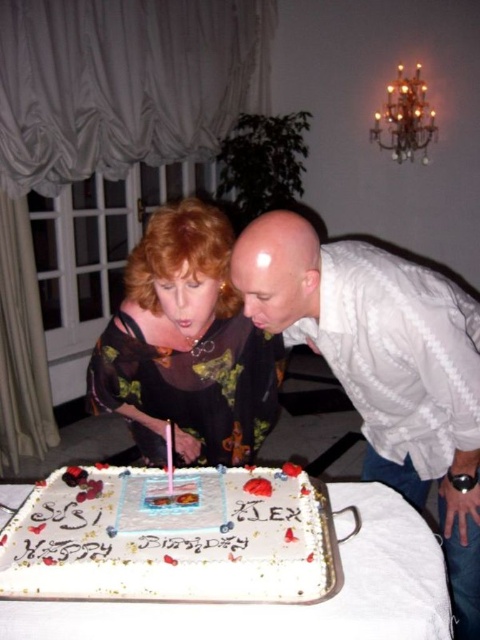
Question: Considering the relative positions of white cardboard cake at center and pink wax candle at center in the image provided, where is white cardboard cake at center located with respect to pink wax candle at center?

Choices:
 (A) left
 (B) right

Answer: (B)

Question: Can you confirm if white textured shirt at center is positioned above pink wax candle at center?

Choices:
 (A) no
 (B) yes

Answer: (B)

Question: Is white textured shirt at center positioned behind pink wax candle at center?

Choices:
 (A) no
 (B) yes

Answer: (B)

Question: Which object is closer to the camera taking this photo?

Choices:
 (A) white textured shirt at center
 (B) white cardboard cake at center

Answer: (B)

Question: Which point is farther from the camera taking this photo?

Choices:
 (A) (106, 612)
 (B) (360, 308)

Answer: (B)

Question: Which point is farther to the camera?

Choices:
 (A) (101, 410)
 (B) (458, 512)
 (C) (421, 540)
 (D) (172, 428)

Answer: (A)